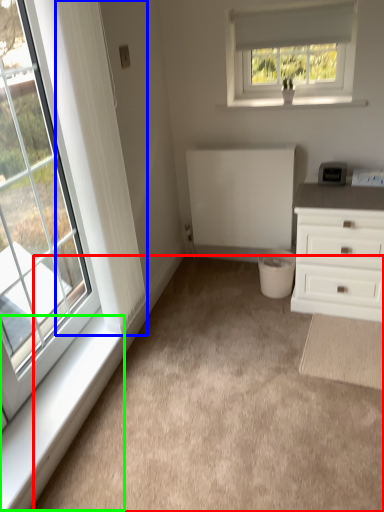
Question: Based on their relative distances, which object is nearer to plain (highlighted by a red box)? Choose from curtain (highlighted by a blue box) and window sill (highlighted by a green box).

Choices:
 (A) curtain
 (B) window sill

Answer: (B)